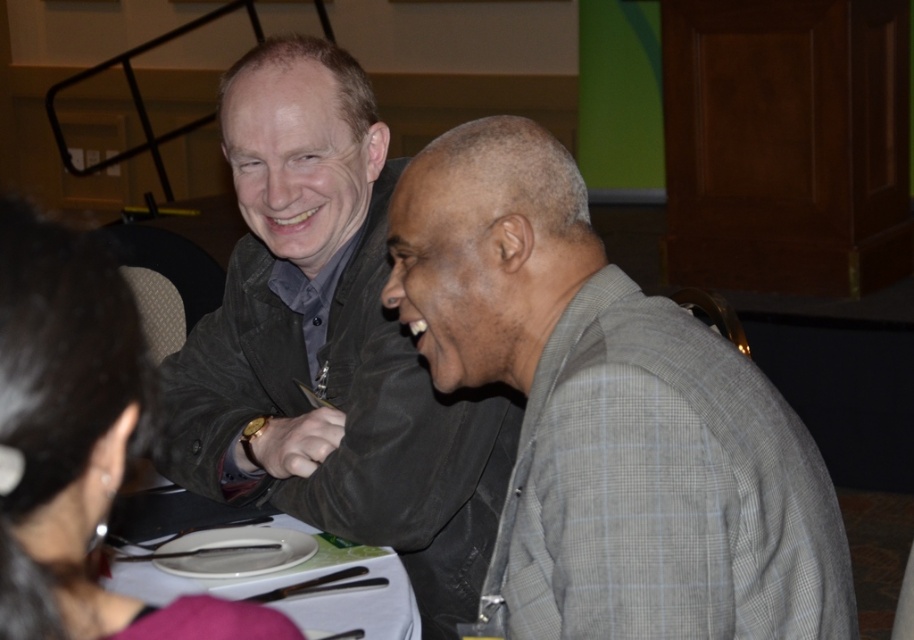
You are standing in the room and want to place a small decorative item on the table between the two points labeled point (796, 557) and point (221, 452). Which point should you choose if you want the item to be closer to you?

You should place the item at point (796, 557) because it is closer to the viewer than point (221, 452).

You are standing at the entrance of the room and want to approach the gray checkered suit at right. Based on their position, which direction should you walk to reach them?

The gray checkered suit at right is located at point 0.652 on the x axis and 0.667 on the y axis. Since you are at the entrance, you should walk towards the right and slightly forward to reach them.

In the scene, there are two people seated at a table. The person on the left is wearing a dark jacket and the person on the right is wearing a gray checkered suit. Based on the coordinates provided, can you determine which person is closer to the point at position (x=609, y=417)?

The gray checkered suit at right is represented by point (x=609, y=417), so the person on the right wearing the gray checkered suit is exactly at that coordinate.